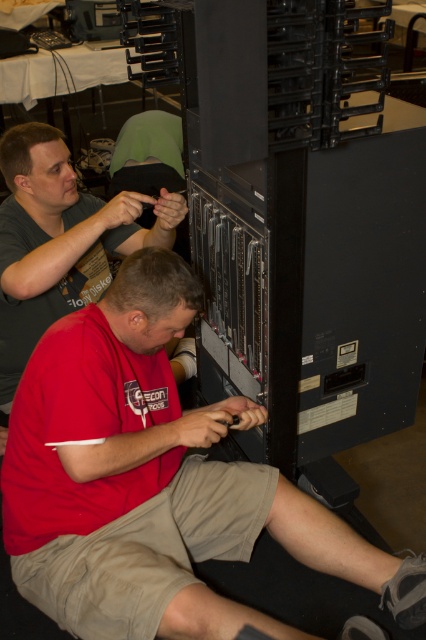
Question: In this image, where is red matte shirt at lower left located relative to matte black shirt at upper left?

Choices:
 (A) below
 (B) above

Answer: (A)

Question: Can you confirm if red matte shirt at lower left is positioned above matte black shirt at upper left?

Choices:
 (A) yes
 (B) no

Answer: (B)

Question: Which of the following is the closest to the observer?

Choices:
 (A) (65, 556)
 (B) (34, 308)

Answer: (A)

Question: Where is red matte shirt at lower left located in relation to matte black shirt at upper left in the image?

Choices:
 (A) right
 (B) left

Answer: (A)

Question: Which point is farther to the camera?

Choices:
 (A) (204, 484)
 (B) (178, 196)

Answer: (B)